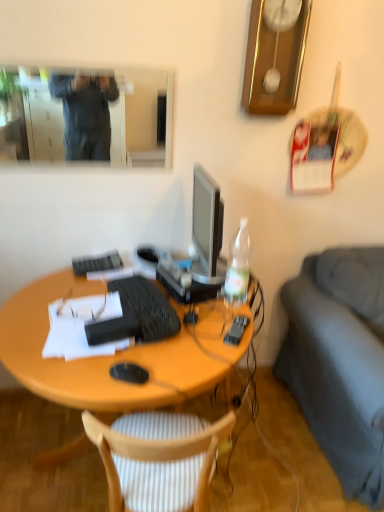
Find the location of a particular element. The height and width of the screenshot is (512, 384). free space behind black plastic remote control at right is located at coordinates (232, 310).